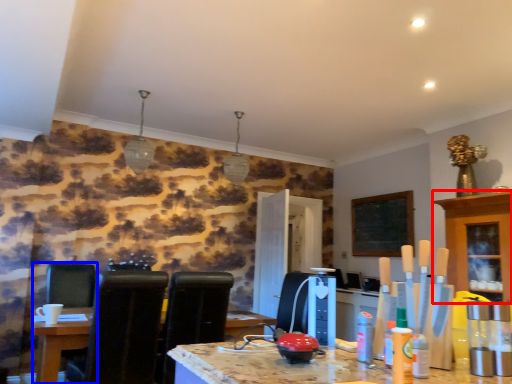
Question: Among these objects, which one is nearest to the camera, cabinetry (highlighted by a red box) or chair (highlighted by a blue box)?

Choices:
 (A) cabinetry
 (B) chair

Answer: (A)